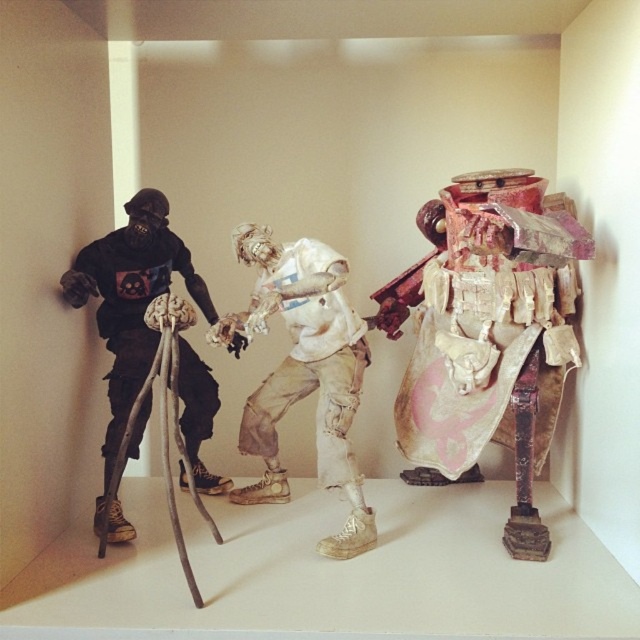
Who is taller, distressed fabric shield at center or white matte figure at center?

Standing taller between the two is distressed fabric shield at center.

Is point (531, 339) positioned behind point (244, 314)?

No, it is not.

Who is more distant from viewer, (x=467, y=358) or (x=312, y=342)?

The point (x=312, y=342) is more distant.

I want to click on distressed fabric shield at center, so click(488, 333).

Identify the location of white matte figure at center. (304, 372).

Which is below, white matte figure at center or matte black figure at left?

Positioned lower is white matte figure at center.

Where is `white matte figure at center`? The image size is (640, 640). white matte figure at center is located at coordinates (304, 372).

This screenshot has width=640, height=640. Find the location of `white matte figure at center`. white matte figure at center is located at coordinates (304, 372).

You are a GUI agent. You are given a task and a screenshot of the screen. Output one action in this format:
    pyautogui.click(x=<x>, y=<y>)
    Task: Click on the distressed fabric shield at center
    The height and width of the screenshot is (640, 640).
    Given the screenshot: What is the action you would take?
    pyautogui.click(x=488, y=333)

Who is more distant from viewer, (515,452) or (129,296)?

The point (129,296) is more distant.

The image size is (640, 640). In order to click on distressed fabric shield at center in this screenshot , I will do `click(488, 333)`.

Where is `distressed fabric shield at center`? This screenshot has width=640, height=640. distressed fabric shield at center is located at coordinates (488, 333).